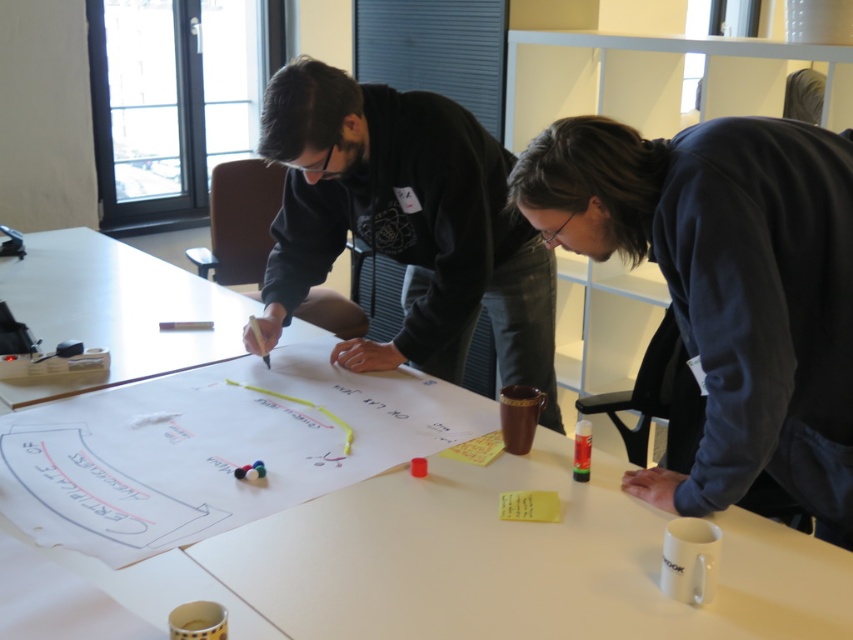
Does white paperboard at center appear on the right side of dark blue sweatshirt at center?

No, white paperboard at center is not to the right of dark blue sweatshirt at center.

In order to click on white paperboard at center in this screenshot , I will do `click(485, 564)`.

From the picture: Can you confirm if dark blue sweatshirt at center is positioned above black matte hoodie at center?

No.

Describe the element at coordinates (724, 298) in the screenshot. I see `dark blue sweatshirt at center` at that location.

Is point (622, 186) positioned behind point (509, 256)?

No, it is not.

Where is `dark blue sweatshirt at center`? The width and height of the screenshot is (853, 640). dark blue sweatshirt at center is located at coordinates (724, 298).

Does white paperboard at center appear under black matte hoodie at center?

Yes, white paperboard at center is below black matte hoodie at center.

Does white paperboard at center have a greater height compared to black matte hoodie at center?

Incorrect, white paperboard at center's height is not larger of black matte hoodie at center's.

Is point (19, 310) positioned before point (387, 170)?

No.

Locate an element on the screen. This screenshot has width=853, height=640. white paperboard at center is located at coordinates (485, 564).